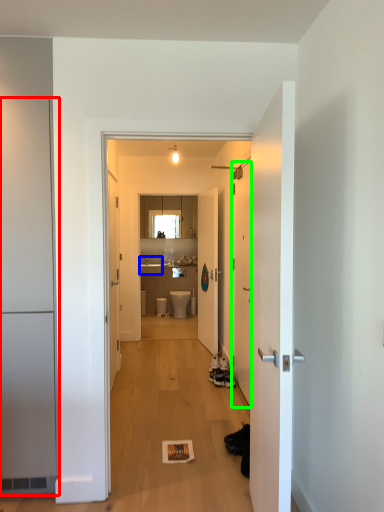
Question: Estimate the real-world distances between objects in this image. Which object is farther from door (highlighted by a red box), sink (highlighted by a blue box) or door (highlighted by a green box)?

Choices:
 (A) sink
 (B) door

Answer: (A)